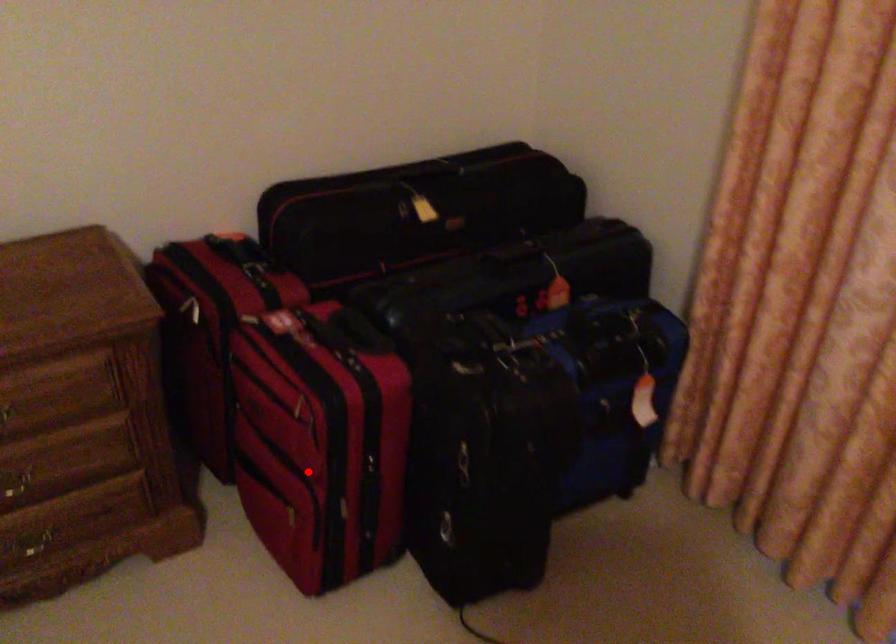
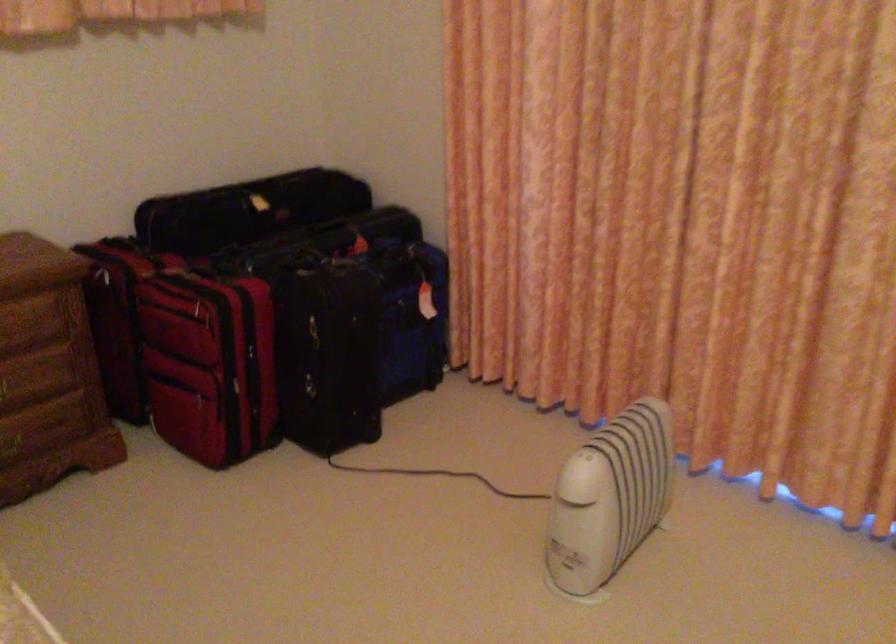
The point at the highlighted location is marked in the first image. Where is the corresponding point in the second image?

(209, 364)